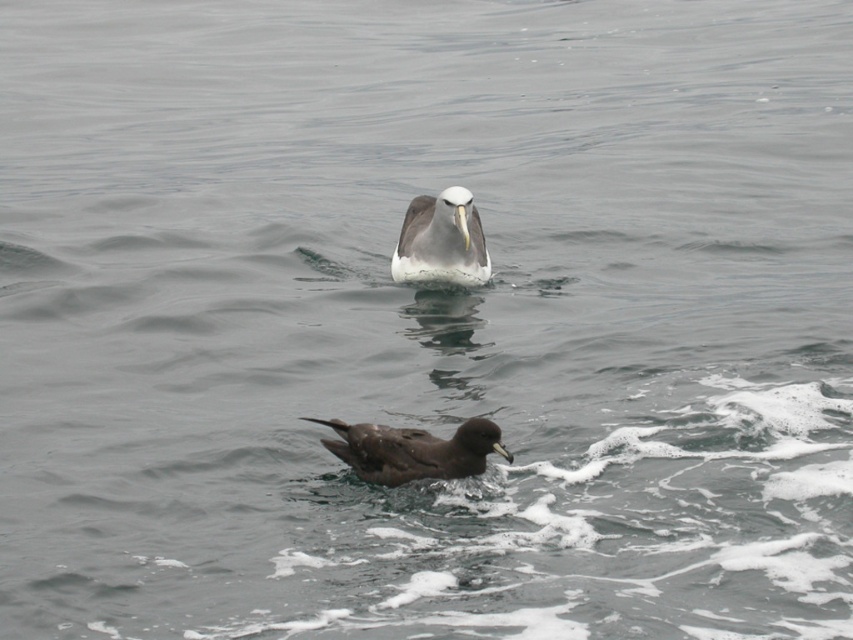
Question: Can you confirm if dark brown feathers at lower center is positioned below white glossy bird at center?

Choices:
 (A) yes
 (B) no

Answer: (A)

Question: Which point is farther to the camera?

Choices:
 (A) (381, 451)
 (B) (410, 208)

Answer: (B)

Question: From the image, what is the correct spatial relationship of dark brown feathers at lower center in relation to white glossy bird at center?

Choices:
 (A) below
 (B) above

Answer: (A)

Question: Can you confirm if dark brown feathers at lower center is thinner than white glossy bird at center?

Choices:
 (A) no
 (B) yes

Answer: (A)